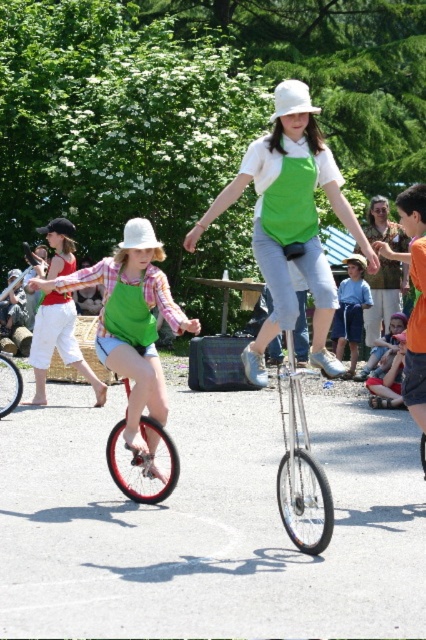
You are a photographer trying to capture a clear shot of both the green matte apron at center and the green fabric dress at center. Since both are green, you need to adjust your camera focus to ensure one isn not obscured. Based on their positions, which one should you focus on first to ensure it appears sharp in the photo?

The green matte apron at center is in front of the green fabric dress at center, so you should focus on the green matte apron at center first to ensure it appears sharp and doesn not block the dress behind it.

You are a photographer trying to capture a photo of the two unicycle riders. You want to ensure that both the matte green apron at center and the blue denim shorts at center are clearly visible in the frame. Based on their positions, which object should you focus on first to ensure both are in focus?

The matte green apron at center is to the left of blue denim shorts at center. Since they are positioned side by side, focusing on the matte green apron at center first will help ensure both are in focus as they are aligned horizontally.